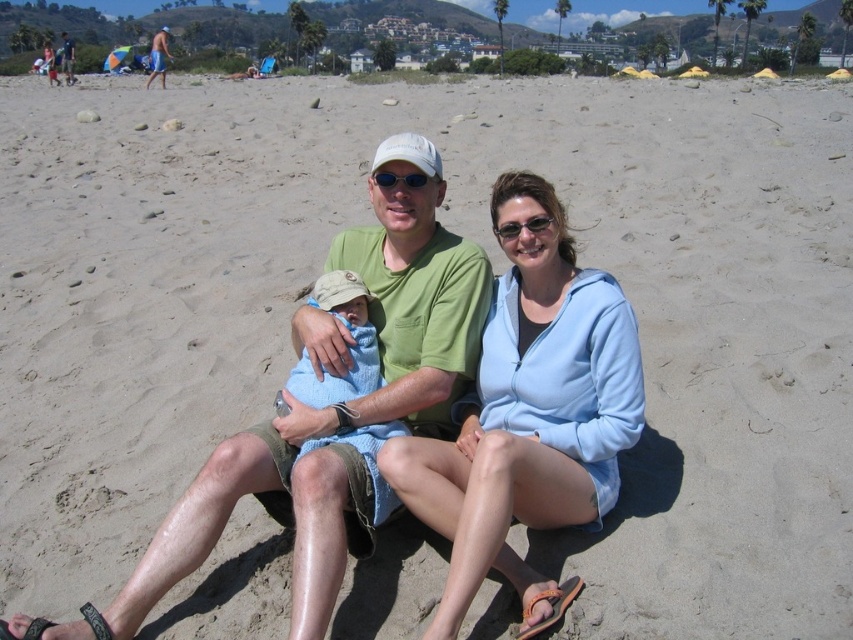
Question: Does blue shorts at upper left appear under matte white sunglasses at center?

Choices:
 (A) yes
 (B) no

Answer: (B)

Question: Among these points, which one is nearest to the camera?

Choices:
 (A) (396, 179)
 (B) (630, 358)
 (C) (154, 67)

Answer: (B)

Question: Can you confirm if light blue fleece jacket at center is positioned below blue shorts at upper left?

Choices:
 (A) yes
 (B) no

Answer: (A)

Question: Which point is closer to the camera?

Choices:
 (A) blue shorts at upper left
 (B) matte white sunglasses at center
 (C) light blue fleece jacket at center

Answer: (C)

Question: Where is blue shorts at upper left located in relation to matte white sunglasses at center in the image?

Choices:
 (A) above
 (B) below

Answer: (A)

Question: Which of these objects is positioned closest to the blue shorts at upper left?

Choices:
 (A) matte white sunglasses at center
 (B) light blue fleece jacket at center

Answer: (B)